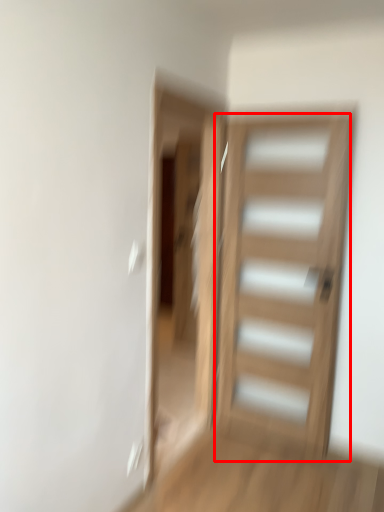
Question: From the image, what is the correct spatial relationship of door (annotated by the red box) in relation to screen door?

Choices:
 (A) right
 (B) left

Answer: (A)